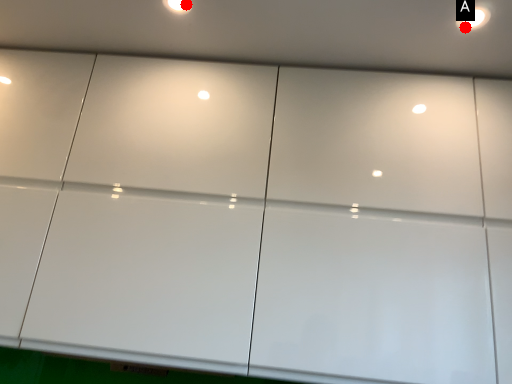
Question: Two points are circled on the image, labeled by A and B beside each circle. Which point is farther from the camera taking this photo?

Choices:
 (A) A is further
 (B) B is further

Answer: (B)